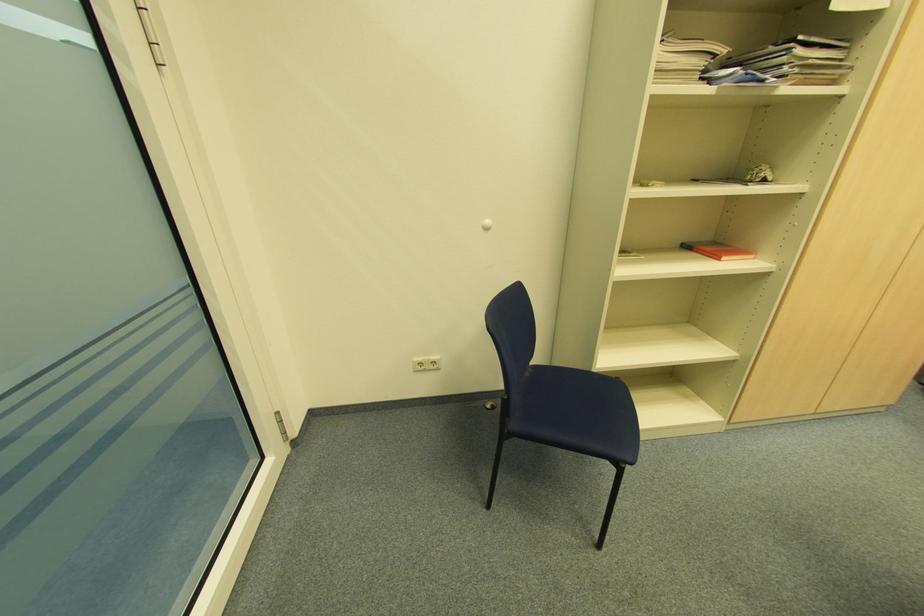
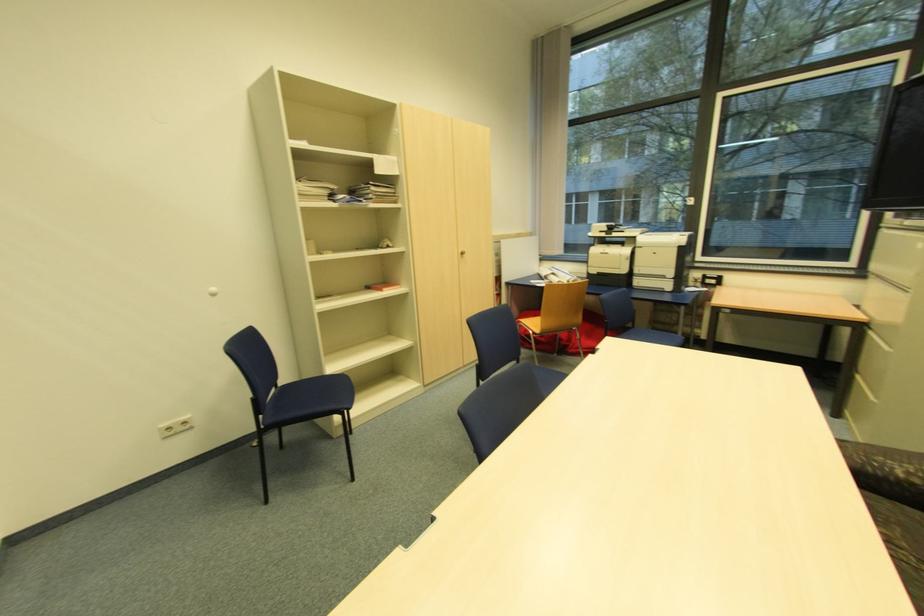
Locate, in the second image, the point that corresponds to [596,370] in the first image.

(325, 375)